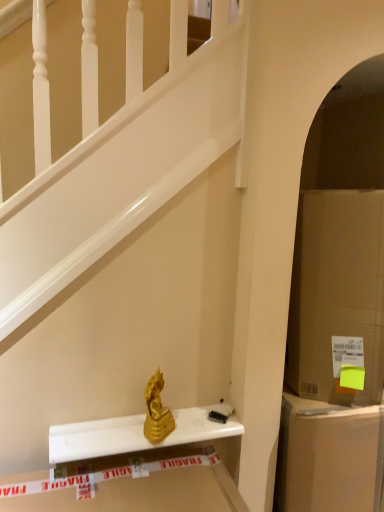
The width and height of the screenshot is (384, 512). I want to click on vacant space to the right of gold metallic statue at center, so click(196, 431).